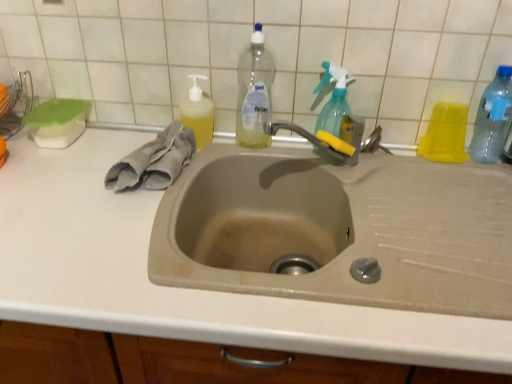
This screenshot has width=512, height=384. What do you see at coordinates (332, 99) in the screenshot?
I see `transparent plastic spray bottle at upper right, the second cleaning product from the left` at bounding box center [332, 99].

Locate an element on the screen. clear plastic bottle at upper center, which is the 1th bottle from left to right is located at coordinates (254, 92).

The width and height of the screenshot is (512, 384). What do you see at coordinates (198, 113) in the screenshot?
I see `yellow translucent liquid at upper left, which is the second cleaning product in right-to-left order` at bounding box center [198, 113].

Looking at this image, what is the approximate height of white tile at upper center?

It is 13.72 inches.

This screenshot has width=512, height=384. What do you see at coordinates (268, 48) in the screenshot? I see `white tile at upper center` at bounding box center [268, 48].

This screenshot has height=384, width=512. Describe the element at coordinates (492, 118) in the screenshot. I see `transparent plastic bottle at right, which appears as the first bottle when viewed from the right` at that location.

Image resolution: width=512 pixels, height=384 pixels. Describe the element at coordinates (445, 134) in the screenshot. I see `yellow translucent bottle at right, which appears as the second bottle when viewed from the left` at that location.

Where is `yellow translucent bottle at right, which appears as the second bottle when viewed from the left`? This screenshot has height=384, width=512. yellow translucent bottle at right, which appears as the second bottle when viewed from the left is located at coordinates (445, 134).

This screenshot has width=512, height=384. In order to click on transparent plastic spray bottle at upper right, which is counted as the first cleaning product, starting from the right in this screenshot , I will do `click(332, 99)`.

Would you say transparent plastic spray bottle at upper right, the second cleaning product from the left, is outside yellow translucent bottle at right, which appears as the second bottle when viewed from the left?

Indeed, transparent plastic spray bottle at upper right, the second cleaning product from the left, is completely outside yellow translucent bottle at right, which appears as the second bottle when viewed from the left.

Considering the sizes of objects transparent plastic spray bottle at upper right, which is counted as the first cleaning product, starting from the right, and yellow translucent bottle at right, which appears as the second bottle when viewed from the left, in the image provided, who is shorter, transparent plastic spray bottle at upper right, which is counted as the first cleaning product, starting from the right, or yellow translucent bottle at right, which appears as the second bottle when viewed from the left,?

yellow translucent bottle at right, which appears as the second bottle when viewed from the left, is shorter.

From the image's perspective, who appears lower, transparent plastic spray bottle at upper right, the second cleaning product from the left, or yellow translucent bottle at right, acting as the 2th bottle starting from the right?

yellow translucent bottle at right, acting as the 2th bottle starting from the right, is shown below in the image.

Is yellow rubber tap at upper center outside of transparent plastic bottle at right, the third bottle when ordered from left to right?

yellow rubber tap at upper center is positioned outside transparent plastic bottle at right, the third bottle when ordered from left to right.

Between yellow rubber tap at upper center and transparent plastic bottle at right, which appears as the first bottle when viewed from the right, which one has smaller width?

yellow rubber tap at upper center is thinner.

Between point (350, 155) and point (485, 138), which one is positioned in front?

The point (350, 155) is closer to the camera.

Between yellow translucent liquid at upper left, which is the second cleaning product in right-to-left order, and white tile at upper center, which one is positioned behind?

yellow translucent liquid at upper left, which is the second cleaning product in right-to-left order, is further away from the camera.

Can you confirm if yellow translucent liquid at upper left, which is the second cleaning product in right-to-left order, is smaller than white tile at upper center?

Yes.

Considering the sizes of objects yellow translucent liquid at upper left, which is the second cleaning product in right-to-left order, and white tile at upper center in the image provided, who is wider, yellow translucent liquid at upper left, which is the second cleaning product in right-to-left order, or white tile at upper center?

yellow translucent liquid at upper left, which is the second cleaning product in right-to-left order, is wider.

Do you think yellow translucent liquid at upper left, marked as the first cleaning product in a left-to-right arrangement, is within white tile at upper center, or outside of it?

yellow translucent liquid at upper left, marked as the first cleaning product in a left-to-right arrangement, is spatially situated outside white tile at upper center.

Can you tell me how much yellow translucent bottle at right, which appears as the second bottle when viewed from the left, and clear plastic bottle at upper center, arranged as the 3th bottle when viewed from the right, differ in facing direction?

The angle between the facing direction of yellow translucent bottle at right, which appears as the second bottle when viewed from the left, and the facing direction of clear plastic bottle at upper center, arranged as the 3th bottle when viewed from the right, is 0.000786 degrees.

Is clear plastic bottle at upper center, which is the 1th bottle from left to right, a part of yellow translucent bottle at right, which appears as the second bottle when viewed from the left?

No, clear plastic bottle at upper center, which is the 1th bottle from left to right, is not a part of yellow translucent bottle at right, which appears as the second bottle when viewed from the left.

From the image's perspective, is yellow translucent bottle at right, acting as the 2th bottle starting from the right, on clear plastic bottle at upper center, arranged as the 3th bottle when viewed from the right?

Actually, yellow translucent bottle at right, acting as the 2th bottle starting from the right, appears below clear plastic bottle at upper center, arranged as the 3th bottle when viewed from the right, in the image.

Is yellow translucent bottle at right, acting as the 2th bottle starting from the right, wider than clear plastic bottle at upper center, which is the 1th bottle from left to right?

Result: Incorrect, the width of yellow translucent bottle at right, acting as the 2th bottle starting from the right, does not surpass that of clear plastic bottle at upper center, which is the 1th bottle from left to right.

Is the depth of yellow rubber tap at upper center less than that of yellow translucent liquid at upper left, marked as the first cleaning product in a left-to-right arrangement?

Yes, it is.

Which is in front, point (319, 140) or point (188, 99)?

Point (319, 140)

Can you tell me how much yellow rubber tap at upper center and yellow translucent liquid at upper left, marked as the first cleaning product in a left-to-right arrangement, differ in facing direction?

49.1 degrees.

From a real-world perspective, which is physically below, yellow rubber tap at upper center or yellow translucent liquid at upper left, marked as the first cleaning product in a left-to-right arrangement?

yellow rubber tap at upper center.

From the image's perspective, which one is positioned higher, beige matte sink at center or yellow rubber tap at upper center?

yellow rubber tap at upper center is shown above in the image.

Based on the photo, from a real-world perspective, between beige matte sink at center and yellow rubber tap at upper center, who is vertically lower?

beige matte sink at center, from a real-world perspective.

Does beige matte sink at center lie in front of yellow rubber tap at upper center?

Yes, beige matte sink at center is closer to the viewer.

Is beige matte sink at center to the right of yellow rubber tap at upper center from the viewer's perspective?

Yes.

From the image's perspective, relative to white tile at upper center, is beige matte sink at center above or below?

beige matte sink at center is below white tile at upper center.

Could you tell me if beige matte sink at center is facing white tile at upper center?

No.

Is beige matte sink at center in front of or behind white tile at upper center in the image?

beige matte sink at center is in front of white tile at upper center.

From the transparent plastic spray bottle at upper right, the second cleaning product from the left, count 1st bottle to the right and point to it. Please provide its 2D coordinates.

[(445, 134)]

Locate an element on the screen. The height and width of the screenshot is (384, 512). tap directly beneath the transparent plastic bottle at right, which appears as the first bottle when viewed from the right (from a real-world perspective) is located at coordinates (319, 141).

Looking at the image, which one is located closer to yellow translucent bottle at right, acting as the 2th bottle starting from the right, transparent plastic bottle at right, which appears as the first bottle when viewed from the right, or white tile at upper center?

Among the two, transparent plastic bottle at right, which appears as the first bottle when viewed from the right, is located nearer to yellow translucent bottle at right, acting as the 2th bottle starting from the right.

Based on their spatial positions, is yellow rubber tap at upper center or transparent plastic spray bottle at upper right, the second cleaning product from the left, closer to gray cotton hand towel at left?

The object closer to gray cotton hand towel at left is yellow rubber tap at upper center.

From the image, which object appears to be nearer to yellow translucent liquid at upper left, marked as the first cleaning product in a left-to-right arrangement, beige matte sink at center or white tile at upper center?

white tile at upper center is closer to yellow translucent liquid at upper left, marked as the first cleaning product in a left-to-right arrangement.

Estimate the real-world distances between objects in this image. Which object is closer to yellow translucent liquid at upper left, marked as the first cleaning product in a left-to-right arrangement, clear plastic bottle at upper center, arranged as the 3th bottle when viewed from the right, or gray cotton hand towel at left?

The object closer to yellow translucent liquid at upper left, marked as the first cleaning product in a left-to-right arrangement, is gray cotton hand towel at left.

From the image, which object appears to be farther from yellow rubber tap at upper center, transparent plastic bottle at right, which appears as the first bottle when viewed from the right, or gray cotton hand towel at left?

Among the two, transparent plastic bottle at right, which appears as the first bottle when viewed from the right, is located further to yellow rubber tap at upper center.

When comparing their distances from gray cotton hand towel at left, does yellow translucent liquid at upper left, marked as the first cleaning product in a left-to-right arrangement, or yellow rubber tap at upper center seem further?

Based on the image, yellow rubber tap at upper center appears to be further to gray cotton hand towel at left.

Looking at the image, which one is located closer to yellow translucent liquid at upper left, which is the second cleaning product in right-to-left order, beige matte sink at center or yellow rubber tap at upper center?

Based on the image, yellow rubber tap at upper center appears to be nearer to yellow translucent liquid at upper left, which is the second cleaning product in right-to-left order.

Consider the image. Which object lies further to the anchor point yellow translucent bottle at right, acting as the 2th bottle starting from the right, beige matte sink at center or gray cotton hand towel at left?

beige matte sink at center is positioned further to the anchor yellow translucent bottle at right, acting as the 2th bottle starting from the right.

Identify the location of bottle situated between yellow rubber tap at upper center and transparent plastic bottle at right, the third bottle when ordered from left to right, from left to right. (445, 134).

You are a GUI agent. You are given a task and a screenshot of the screen. Output one action in this format:
    pyautogui.click(x=<x>, y=<y>)
    Task: Click on the tap between gray cotton hand towel at left and yellow translucent bottle at right, which appears as the second bottle when viewed from the left, in the horizontal direction
    The image size is (512, 384).
    Given the screenshot: What is the action you would take?
    319,141

Identify the location of tap between gray cotton hand towel at left and transparent plastic bottle at right, the third bottle when ordered from left to right. (319, 141).

In order to click on tile between yellow translucent liquid at upper left, marked as the first cleaning product in a left-to-right arrangement, and clear plastic bottle at upper center, arranged as the 3th bottle when viewed from the right, from left to right in this screenshot , I will do (268, 48).